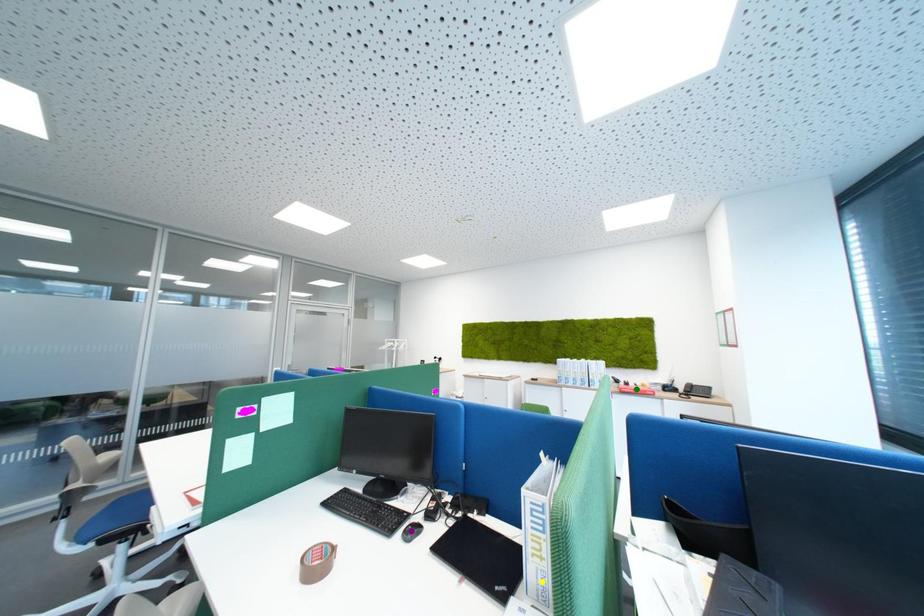
Order these from nearest to farthest:
- green point
- purple point
- yellow point

green point
purple point
yellow point